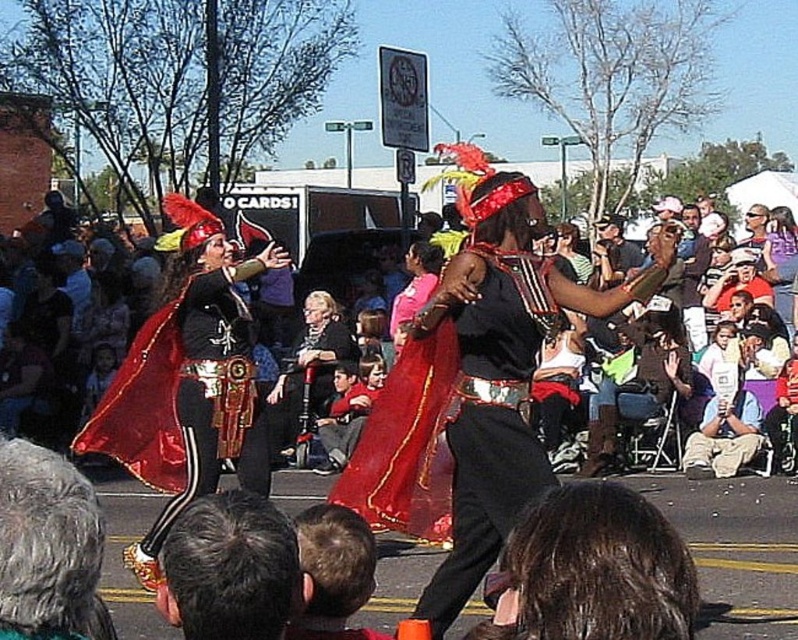
Question: Does shiny black dress at center appear under matte black dress at center?

Choices:
 (A) no
 (B) yes

Answer: (A)

Question: Among these objects, which one is nearest to the camera?

Choices:
 (A) shiny black dress at center
 (B) shiny red cape at left

Answer: (A)

Question: Can you confirm if shiny red cape at left is positioned below gray hair at lower center?

Choices:
 (A) yes
 (B) no

Answer: (A)

Question: Does shiny red cape at left have a greater width compared to shiny black dress at center?

Choices:
 (A) yes
 (B) no

Answer: (A)

Question: Estimate the real-world distances between objects in this image. Which object is closer to the matte black dress at center?

Choices:
 (A) dark brown hair at lower center
 (B) shiny red cape at left

Answer: (B)

Question: Which is farther from the gray hair at lower center?

Choices:
 (A) matte black dress at center
 (B) dark brown hair at lower center
 (C) shiny red cape at left
 (D) shiny black dress at center

Answer: (A)